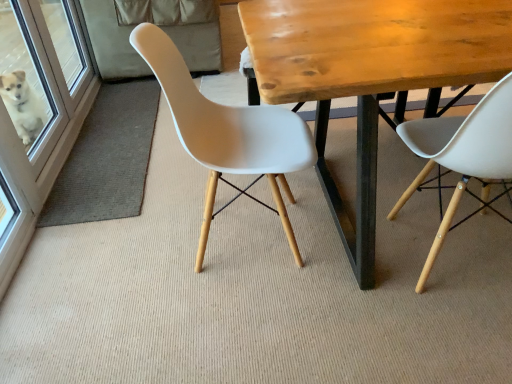
Identify the location of vacant space in white plastic chair at center, the second chair viewed from the right (from a real-world perspective). Image resolution: width=512 pixels, height=384 pixels. (229, 235).